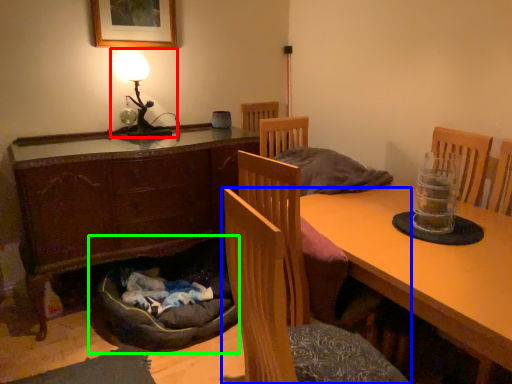
Question: Estimate the real-world distances between objects in this image. Which object is closer to table lamp (highlighted by a red box), chair (highlighted by a blue box) or dog bed (highlighted by a green box)?

Choices:
 (A) chair
 (B) dog bed

Answer: (B)